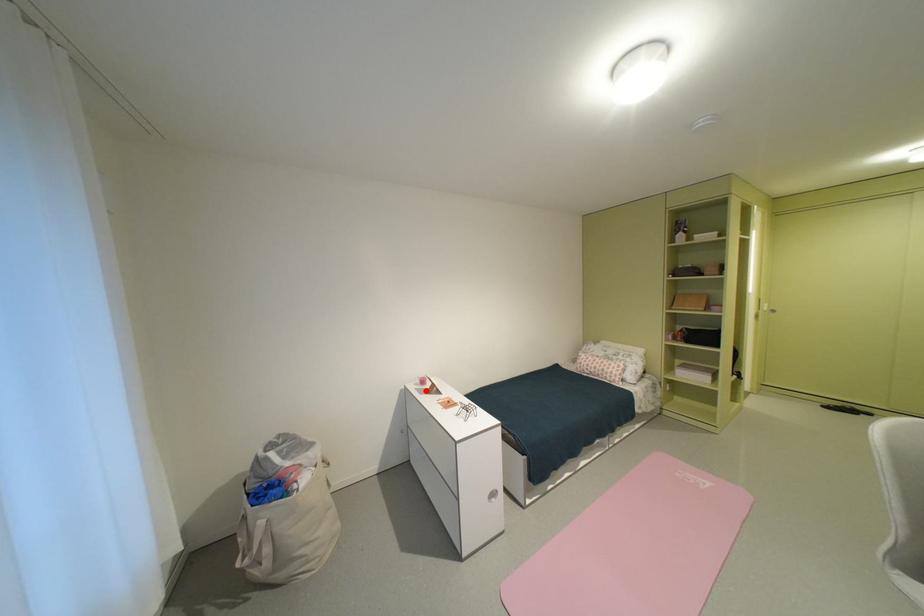
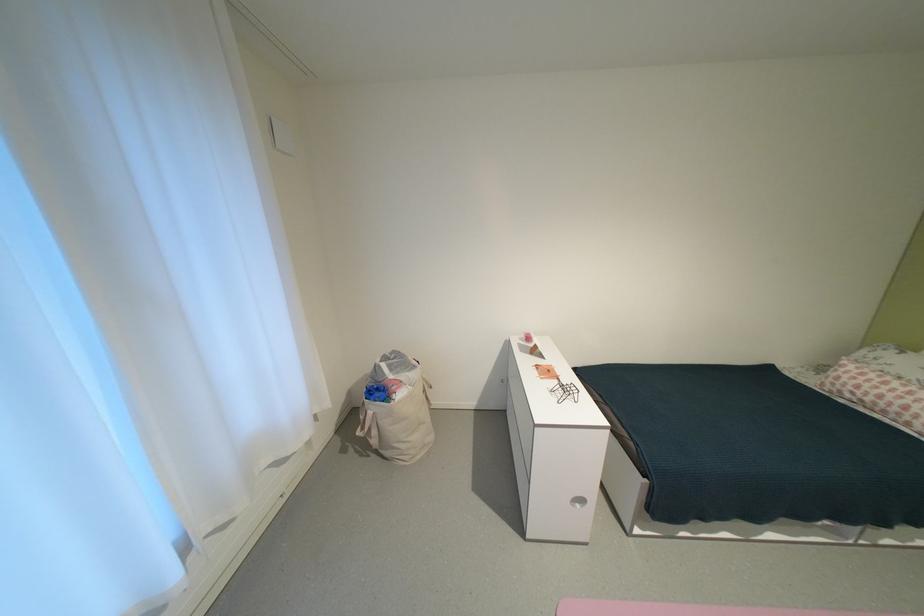
Question: I am providing you with two images of the same scene from different viewpoints. Image1 has a red point marked. In image2, the corresponding 3D location appears at what relative position? Reply with the corresponding letter.

Choices:
 (A) Closer
 (B) Farther

Answer: (A)